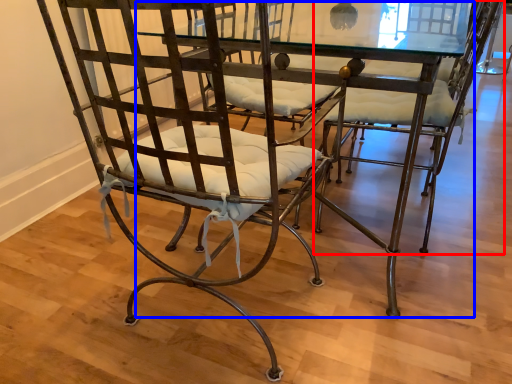
Question: Among these objects, which one is farthest to the camera, chair (highlighted by a red box) or round table (highlighted by a blue box)?

Choices:
 (A) chair
 (B) round table

Answer: (A)